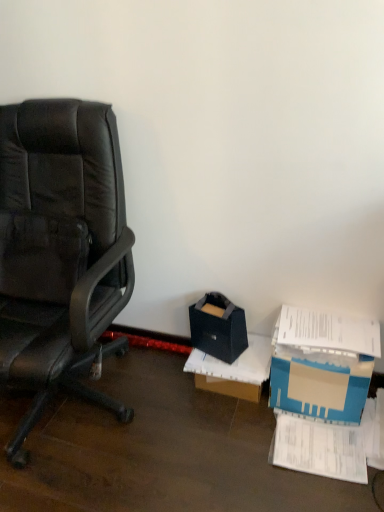
Find the location of `empty space that is ontop of white paper at lower right (from a real-world perspective)`. empty space that is ontop of white paper at lower right (from a real-world perspective) is located at coordinates (320, 452).